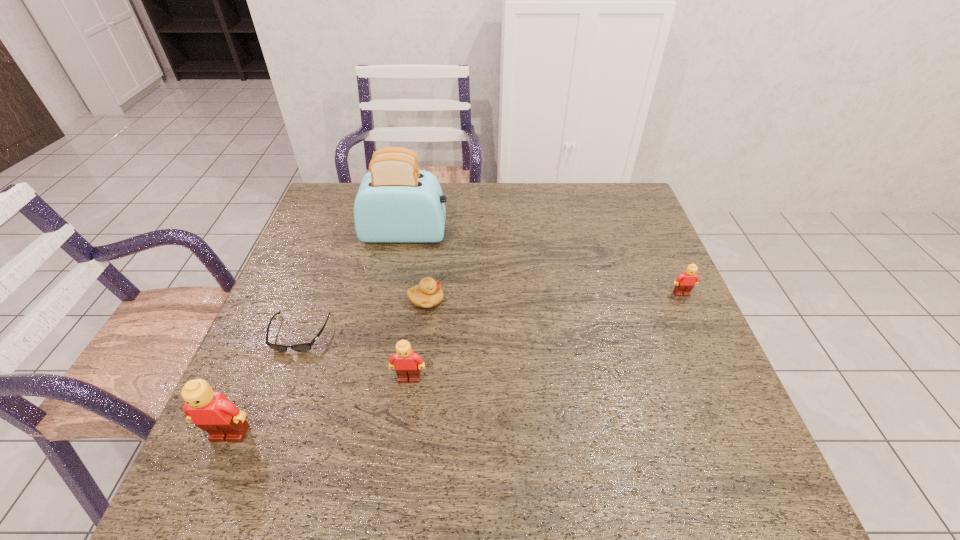
Identify which Lego is located as the nearest to the sunglasses. Please provide its 2D coordinates. Your answer should be formatted as a tuple, i.e. [(x, y)], where the tuple contains the x and y coordinates of a point satisfying the conditions above.

[(213, 412)]

Find the location of `free space that satisfies the following two spatial constraints: 1. at the beak of the fifth tallest object; 2. on the front-facing side of the shortest object`. free space that satisfies the following two spatial constraints: 1. at the beak of the fifth tallest object; 2. on the front-facing side of the shortest object is located at coordinates (422, 334).

In order to click on vacant position in the image that satisfies the following two spatial constraints: 1. on the face of the rightmost Lego; 2. at the beak of the duckling in this screenshot , I will do `click(684, 300)`.

At what (x,y) coordinates should I click in order to perform the action: click on vacant space that satisfies the following two spatial constraints: 1. at the beak of the second shortest object; 2. on the face of the nearest object. Please return your answer as a coordinate pair (x, y). This screenshot has height=540, width=960. Looking at the image, I should click on (410, 434).

Identify the location of blank area in the image that satisfies the following two spatial constraints: 1. on the side of the farthest object with the lever; 2. on the face of the tallest Lego. Image resolution: width=960 pixels, height=540 pixels. (367, 434).

This screenshot has height=540, width=960. I want to click on vacant point that satisfies the following two spatial constraints: 1. on the face of the fourth tallest object; 2. at the beak of the duckling, so click(684, 300).

You are a GUI agent. You are given a task and a screenshot of the screen. Output one action in this format:
    pyautogui.click(x=<x>, y=<y>)
    Task: Click on the vacant area in the image that satisfies the following two spatial constraints: 1. on the side of the farthest object with the lever; 2. on the face of the leftmost Lego
    
    Given the screenshot: What is the action you would take?
    pyautogui.click(x=367, y=434)